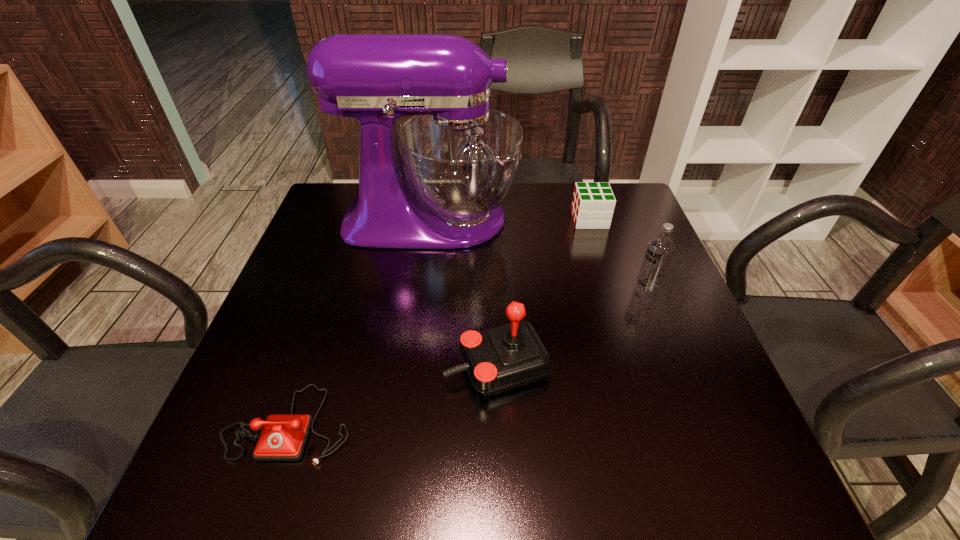
This screenshot has height=540, width=960. Identify the location of vacant area that lies between the telephone and the joystick. (394, 395).

The image size is (960, 540). I want to click on free space between the joystick and the cube, so click(x=543, y=293).

Image resolution: width=960 pixels, height=540 pixels. I want to click on vacant space that's between the second shortest object and the telephone, so click(440, 321).

Where is `free space between the mixer and the third farthest object`? Image resolution: width=960 pixels, height=540 pixels. free space between the mixer and the third farthest object is located at coordinates (540, 252).

At what (x,y) coordinates should I click in order to perform the action: click on free space between the mixer and the rightmost object. Please return your answer as a coordinate pair (x, y). Image resolution: width=960 pixels, height=540 pixels. Looking at the image, I should click on (540, 252).

I want to click on free space between the tallest object and the third nearest object, so click(x=540, y=252).

The image size is (960, 540). Find the location of `free space between the telephone and the second shortest object`. free space between the telephone and the second shortest object is located at coordinates (440, 321).

Identify the location of unoccupied area between the joystick and the cube. (543, 293).

At what (x,y) coordinates should I click in order to perform the action: click on free spot between the joystick and the cube. Please return your answer as a coordinate pair (x, y). Looking at the image, I should click on (543, 293).

Locate which object is the third closest to the telephone. Please provide its 2D coordinates. Your answer should be formatted as a tuple, i.e. [(x, y)], where the tuple contains the x and y coordinates of a point satisfying the conditions above.

[(660, 248)]